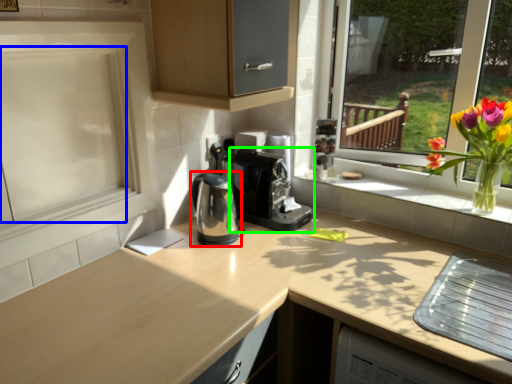
Question: Considering the real-world distances, which object is farthest from coffeepot (highlighted by a red box)? screen door (highlighted by a blue box) or coffee machine (highlighted by a green box)?

Choices:
 (A) screen door
 (B) coffee machine

Answer: (A)